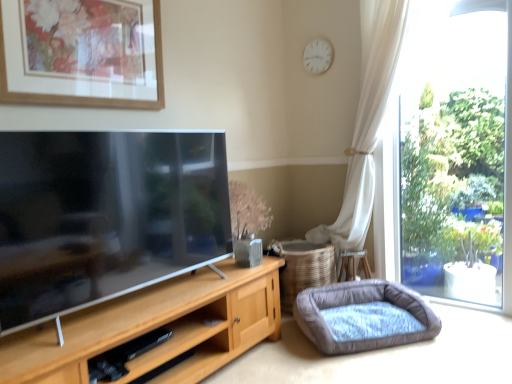
Question: Is white matte clock at upper center next to velvet grey dog bed at lower right?

Choices:
 (A) no
 (B) yes

Answer: (A)

Question: Can you confirm if white matte clock at upper center is thinner than velvet grey dog bed at lower right?

Choices:
 (A) no
 (B) yes

Answer: (B)

Question: Is white matte clock at upper center facing away from velvet grey dog bed at lower right?

Choices:
 (A) yes
 (B) no

Answer: (B)

Question: From a real-world perspective, is white matte clock at upper center on top of velvet grey dog bed at lower right?

Choices:
 (A) no
 (B) yes

Answer: (B)

Question: Is white matte clock at upper center facing towards velvet grey dog bed at lower right?

Choices:
 (A) no
 (B) yes

Answer: (A)

Question: Would you say velvet grey dog bed at lower right is to the left or to the right of white matte clock at upper center in the picture?

Choices:
 (A) right
 (B) left

Answer: (A)

Question: In terms of size, does velvet grey dog bed at lower right appear bigger or smaller than white matte clock at upper center?

Choices:
 (A) big
 (B) small

Answer: (A)

Question: From the image's perspective, is velvet grey dog bed at lower right above or below white matte clock at upper center?

Choices:
 (A) below
 (B) above

Answer: (A)

Question: Is point (414, 314) positioned closer to the camera than point (315, 56)?

Choices:
 (A) farther
 (B) closer

Answer: (B)

Question: Considering the positions of velvet grey dog bed at lower right and matte wooden picture frame at upper left in the image, is velvet grey dog bed at lower right bigger or smaller than matte wooden picture frame at upper left?

Choices:
 (A) big
 (B) small

Answer: (A)

Question: From a real-world perspective, is velvet grey dog bed at lower right above or below matte wooden picture frame at upper left?

Choices:
 (A) below
 (B) above

Answer: (A)

Question: Is velvet grey dog bed at lower right situated inside matte wooden picture frame at upper left or outside?

Choices:
 (A) outside
 (B) inside

Answer: (A)

Question: Based on their positions, is velvet grey dog bed at lower right located to the left or right of matte wooden picture frame at upper left?

Choices:
 (A) right
 (B) left

Answer: (A)

Question: Choose the correct answer: Is white matte clock at upper center inside matte wooden picture frame at upper left or outside it?

Choices:
 (A) outside
 (B) inside

Answer: (A)

Question: From the image's perspective, is white matte clock at upper center above or below matte wooden picture frame at upper left?

Choices:
 (A) above
 (B) below

Answer: (A)